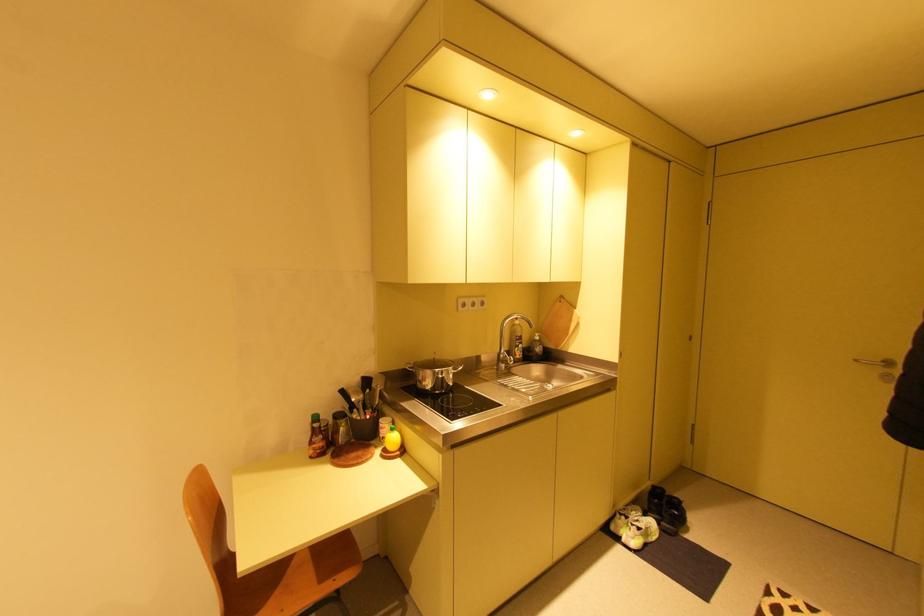
The image size is (924, 616). In order to click on chair sitting surface in this screenshot , I will do `click(288, 580)`.